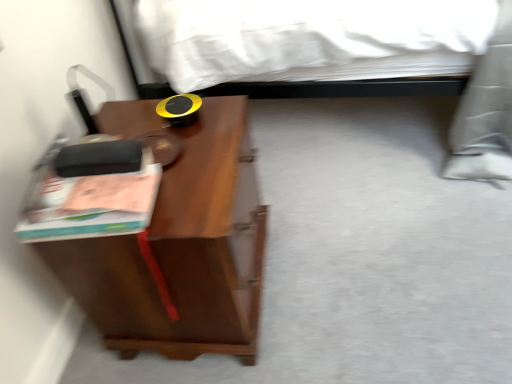
Image resolution: width=512 pixels, height=384 pixels. In order to click on free space to the right of brown wood nightstand at left in this screenshot , I will do (338, 269).